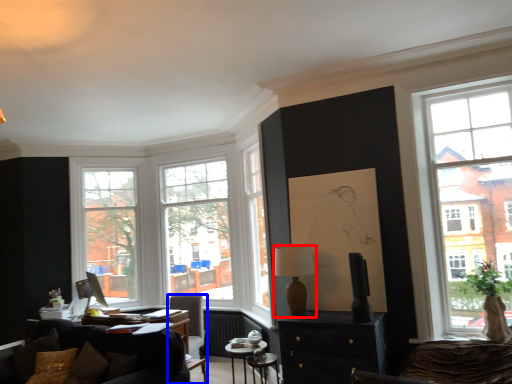
Question: Which of the following is the closest to the observer, lamp (highlighted by a red box) or chair (highlighted by a blue box)?

Choices:
 (A) lamp
 (B) chair

Answer: (A)